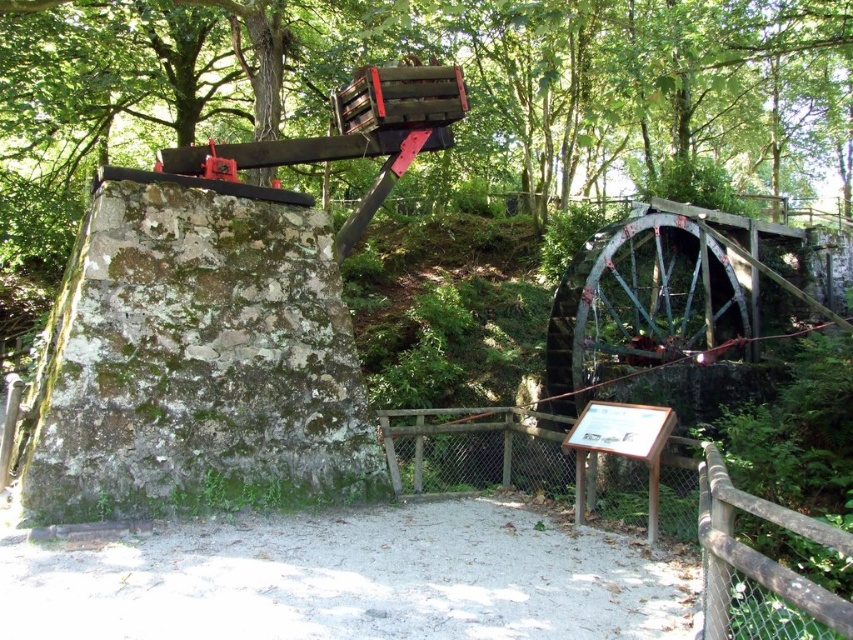
Who is more distant from viewer, (135, 400) or (296, 595)?

Positioned behind is point (135, 400).

Which is below, green mossy stone at left or dirt ground at center?

dirt ground at center is below.

Image resolution: width=853 pixels, height=640 pixels. Find the location of `green mossy stone at left`. green mossy stone at left is located at coordinates (195, 362).

Who is higher up, green mossy stone at left or brown wooden sign at center?

green mossy stone at left

Is point (277, 432) behind point (456, 483)?

No, it is not.

Where is `green mossy stone at left`? Image resolution: width=853 pixels, height=640 pixels. green mossy stone at left is located at coordinates (195, 362).

Which is more to the right, dirt ground at center or brown wooden sign at center?

Positioned to the right is brown wooden sign at center.

Is dirt ground at center smaller than brown wooden sign at center?

Actually, dirt ground at center might be larger than brown wooden sign at center.

Measure the distance between dirt ground at center and camera.

dirt ground at center is 8.99 feet from camera.

I want to click on dirt ground at center, so click(x=344, y=579).